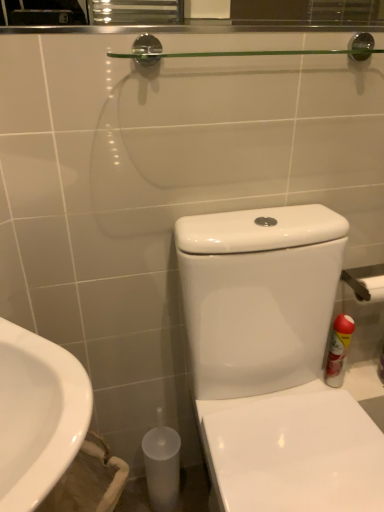
Question: Is red matte spray can at right to the right of white glossy toilet at center from the viewer's perspective?

Choices:
 (A) no
 (B) yes

Answer: (B)

Question: From a real-world perspective, is red matte spray can at right under white glossy toilet at center?

Choices:
 (A) no
 (B) yes

Answer: (B)

Question: Could you tell me if red matte spray can at right is facing white glossy toilet at center?

Choices:
 (A) yes
 (B) no

Answer: (B)

Question: Is red matte spray can at right bigger than white glossy toilet at center?

Choices:
 (A) no
 (B) yes

Answer: (A)

Question: Can you confirm if red matte spray can at right is taller than white glossy toilet at center?

Choices:
 (A) no
 (B) yes

Answer: (A)

Question: Is red matte spray can at right shorter than white glossy toilet at center?

Choices:
 (A) yes
 (B) no

Answer: (A)

Question: From the image's perspective, is white glossy sink at lower left below red matte spray can at right?

Choices:
 (A) no
 (B) yes

Answer: (B)

Question: From a real-world perspective, does white glossy sink at lower left stand above red matte spray can at right?

Choices:
 (A) no
 (B) yes

Answer: (B)

Question: Is white glossy sink at lower left positioned far away from red matte spray can at right?

Choices:
 (A) no
 (B) yes

Answer: (A)

Question: Is white glossy sink at lower left surrounding red matte spray can at right?

Choices:
 (A) yes
 (B) no

Answer: (B)

Question: Is red matte spray can at right at the back of white glossy sink at lower left?

Choices:
 (A) no
 (B) yes

Answer: (A)

Question: From the image's perspective, is white glossy sink at lower left on top of red matte spray can at right?

Choices:
 (A) yes
 (B) no

Answer: (B)

Question: Considering the relative sizes of metallic silver towel bar at right and white glossy toilet at center in the image provided, is metallic silver towel bar at right bigger than white glossy toilet at center?

Choices:
 (A) no
 (B) yes

Answer: (A)